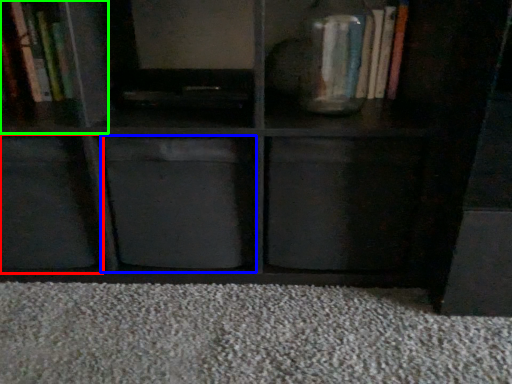
Question: Considering the real-world distances, which object is farthest from cabinet (highlighted by a red box)? cabinet (highlighted by a blue box) or cabinet (highlighted by a green box)?

Choices:
 (A) cabinet
 (B) cabinet

Answer: (B)